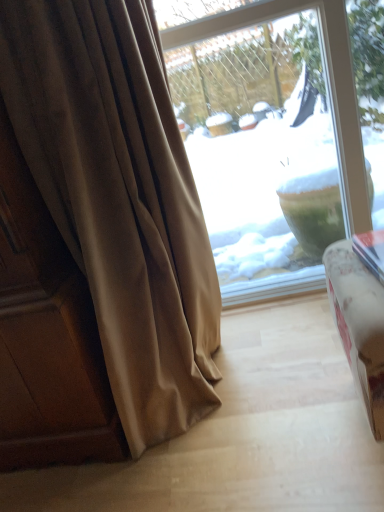
Image resolution: width=384 pixels, height=512 pixels. I want to click on vacant point to the right of brown silk curtain at left, so click(x=296, y=364).